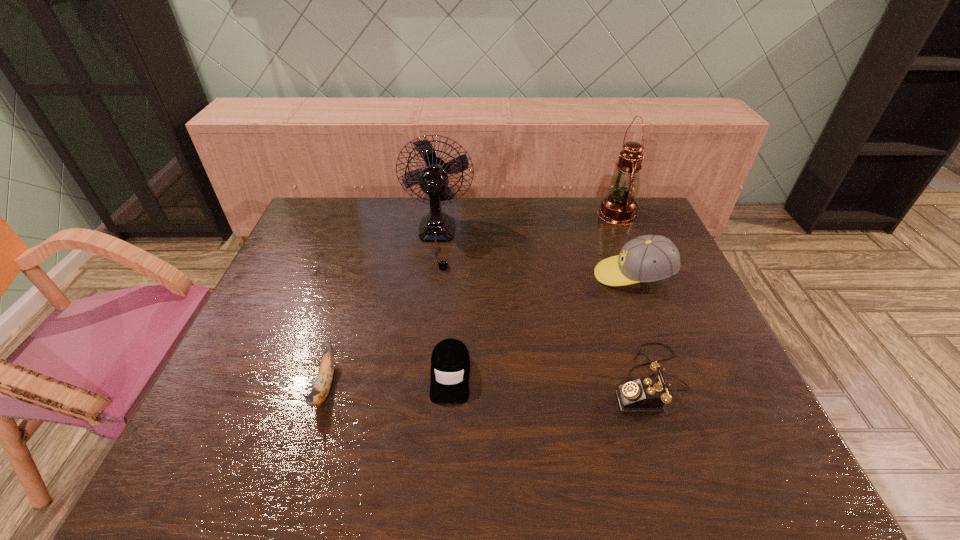
At what (x,y) coordinates should I click in order to perform the action: click on vacant space situated 0.340m on the front-facing side of the third tallest object. Please return your answer as a coordinate pair (x, y). This screenshot has height=540, width=960. Looking at the image, I should click on (480, 275).

What are the coordinates of `vacant space situated 0.360m on the dial of the telephone` in the screenshot? It's located at (458, 380).

Locate an element on the screen. The height and width of the screenshot is (540, 960). free space located 0.150m on the dial of the telephone is located at coordinates (547, 380).

Find the location of a particular element. The height and width of the screenshot is (540, 960). vacant space located on the dial of the telephone is located at coordinates (484, 380).

Locate an element on the screen. free region located on the peel of the banana is located at coordinates (301, 465).

I want to click on vacant space positioned 0.160m on the front-facing side of the shortest object, so click(444, 477).

The image size is (960, 540). Find the location of `oil lamp that is at the far edge`. oil lamp that is at the far edge is located at coordinates pyautogui.click(x=619, y=207).

Find the location of a particular element. The width and height of the screenshot is (960, 540). fan at the far edge is located at coordinates (437, 226).

The height and width of the screenshot is (540, 960). Identify the location of oil lamp situated at the right edge. (619, 207).

Where is `baseball cap situated at the right edge`? The width and height of the screenshot is (960, 540). baseball cap situated at the right edge is located at coordinates (649, 258).